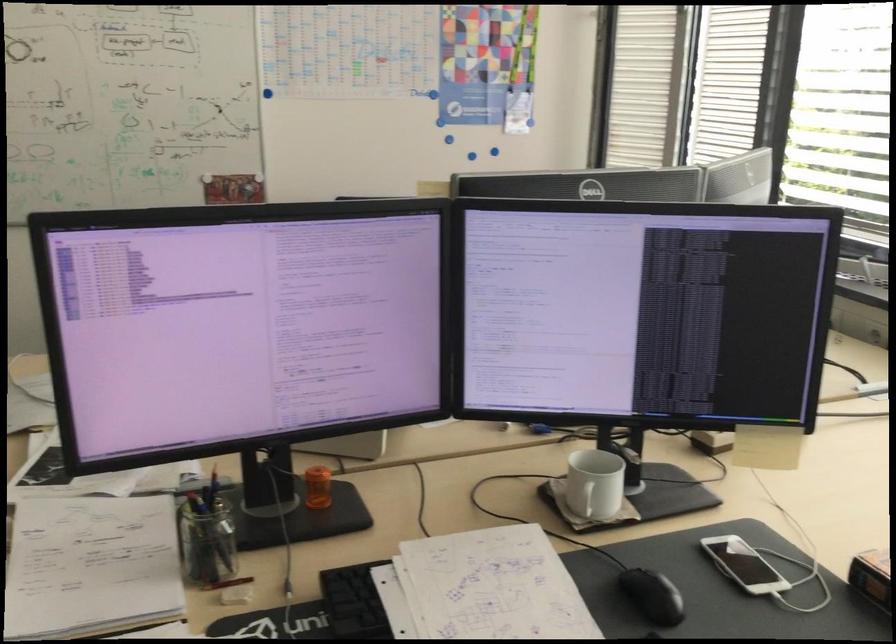
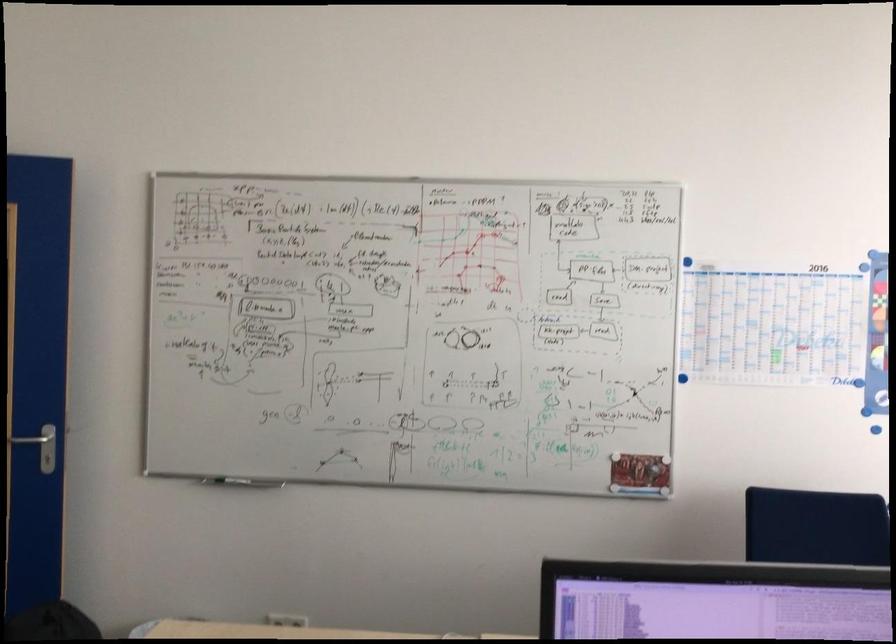
The first image is from the beginning of the video and the second image is from the end. How did the camera likely rotate when shooting the video?

The rotation direction of the camera is left-up.